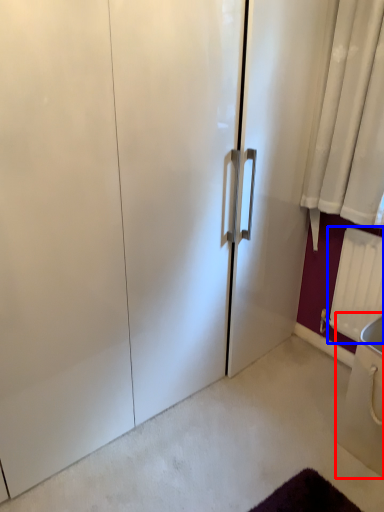
Question: Among these objects, which one is nearest to the camera, sink (highlighted by a red box) or radiator (highlighted by a blue box)?

Choices:
 (A) sink
 (B) radiator

Answer: (A)